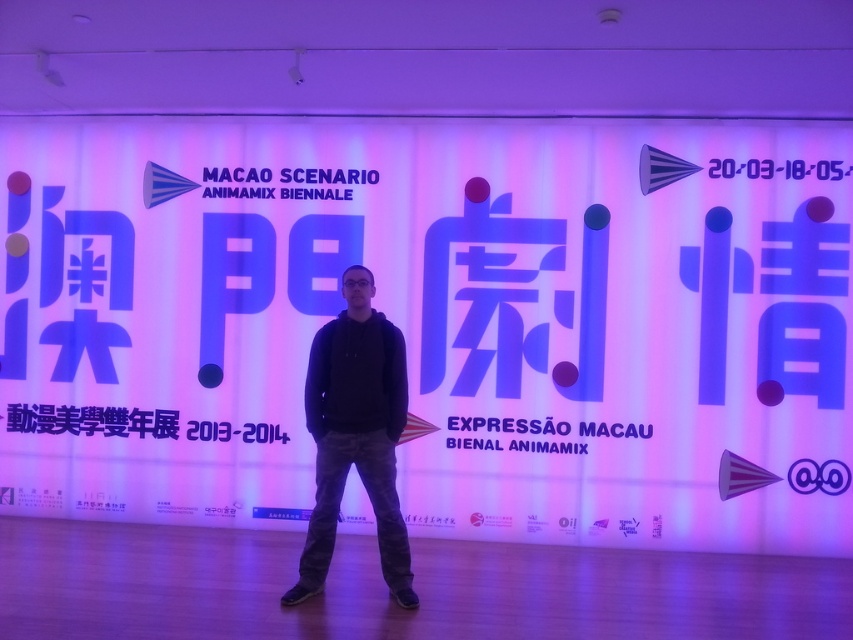
Who is shorter, white matte sign at center or black cotton hoodie at center?

black cotton hoodie at center

Does point (744, 268) come farther from viewer compared to point (361, 394)?

Yes, point (744, 268) is farther from viewer.

Where is `white matte sign at center`? Image resolution: width=853 pixels, height=640 pixels. white matte sign at center is located at coordinates click(434, 323).